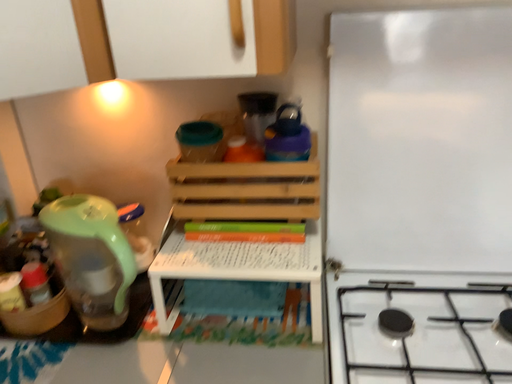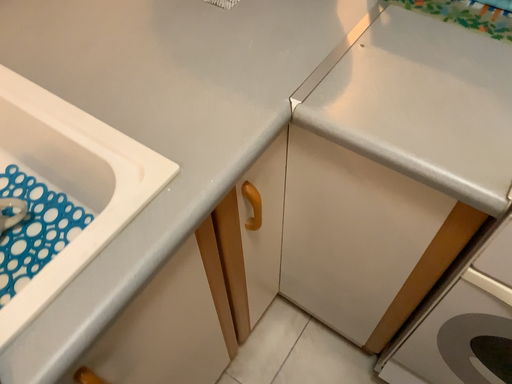
Question: Which way did the camera rotate in the video?

Choices:
 (A) rotated right
 (B) rotated left

Answer: (B)